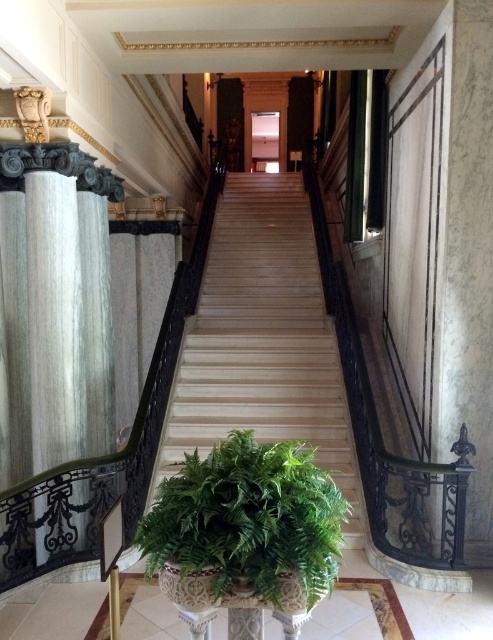
You are standing at the base of the staircase and want to reach a specific point marked as point (189, 360). You have a 20 feet long measuring tape. Can you determine if the measuring tape will be sufficient to reach that point?

The distance of point (189, 360) from viewer is 21.72 feet, so the 20 feet measuring tape is not long enough to reach the point.